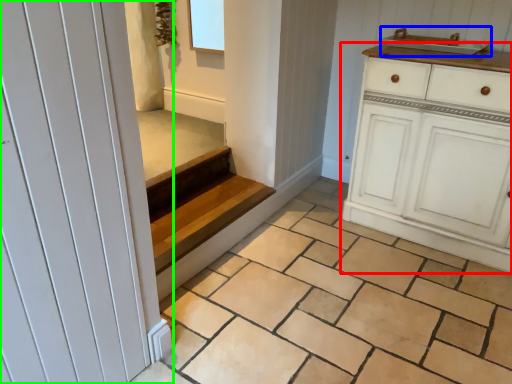
Question: Considering the real-world distances, which object is closest to chest of drawers (highlighted by a red box)? sink (highlighted by a blue box) or door (highlighted by a green box).

Choices:
 (A) sink
 (B) door

Answer: (A)